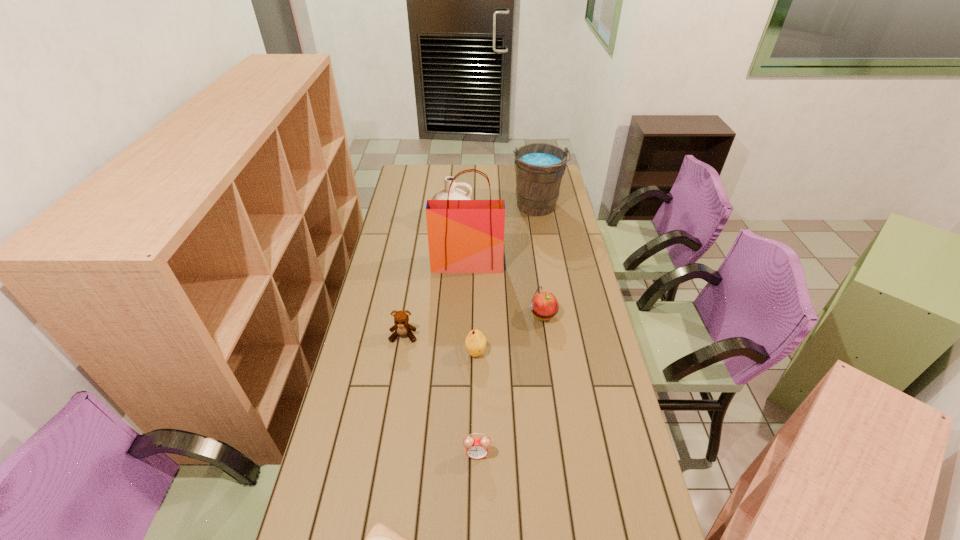
Identify the location of vacant space situated 0.100m to pour from the handle of the third tallest object. This screenshot has height=540, width=960. (449, 245).

Where is `blank area located 0.370m on the front of the apple`? The height and width of the screenshot is (540, 960). blank area located 0.370m on the front of the apple is located at coordinates (558, 416).

Image resolution: width=960 pixels, height=540 pixels. I want to click on free space located on the front-facing side of the teddy bear, so click(398, 364).

At what (x,y) coordinates should I click in order to perform the action: click on free space located 0.260m on the left of the pear. Please return your answer as a coordinate pair (x, y). Image resolution: width=960 pixels, height=540 pixels. Looking at the image, I should click on (391, 352).

At what (x,y) coordinates should I click in order to perform the action: click on free space located on the clock face of the alarm clock. Please return your answer as a coordinate pair (x, y). This screenshot has height=540, width=960. Looking at the image, I should click on (477, 521).

The image size is (960, 540). In order to click on object that is positioned at the left edge in this screenshot , I will do `click(402, 327)`.

Locate an element on the screen. wine bucket that is at the right edge is located at coordinates (539, 167).

I want to click on apple located at the right edge, so click(x=544, y=305).

Where is `vacant region at the far edge of the desktop`? This screenshot has height=540, width=960. vacant region at the far edge of the desktop is located at coordinates (435, 181).

In the image, there is a desktop. Where is `vacant space at the left edge`? The height and width of the screenshot is (540, 960). vacant space at the left edge is located at coordinates (328, 489).